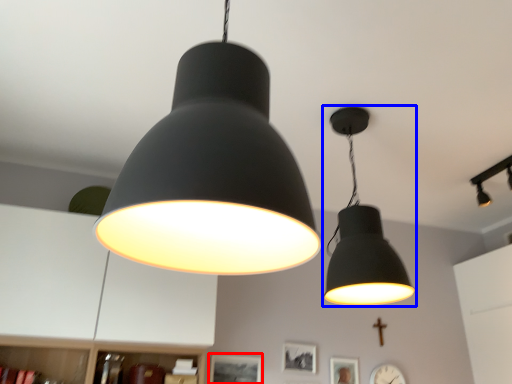
Question: Which point is further to the camera, picture frame (highlighted by a red box) or lamp (highlighted by a blue box)?

Choices:
 (A) picture frame
 (B) lamp

Answer: (A)